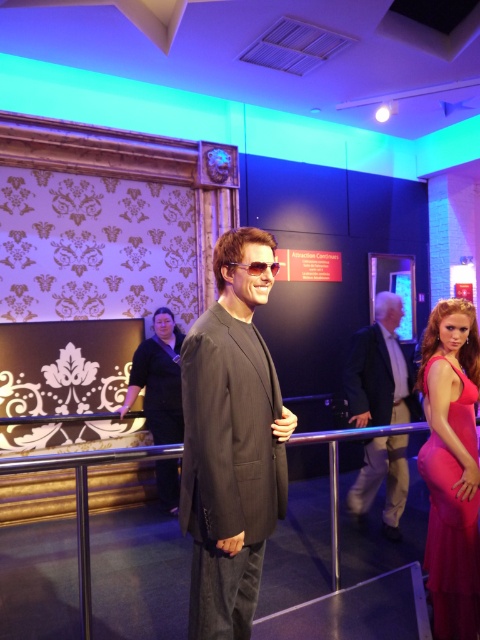
Question: Is dark gray suit at center wider than metallic silver rail at center?

Choices:
 (A) yes
 (B) no

Answer: (B)

Question: Does matte black suit at center lie in front of matte pink dress at right?

Choices:
 (A) no
 (B) yes

Answer: (B)

Question: Estimate the real-world distances between objects in this image. Which object is farther from the black fabric dress at center?

Choices:
 (A) matte pink dress at right
 (B) dark gray suit at center
 (C) sunglasses at center
 (D) matte black suit at center

Answer: (C)

Question: Does matte black suit at center lie behind dark gray suit at center?

Choices:
 (A) no
 (B) yes

Answer: (A)

Question: Which object is positioned closest to the matte pink dress at right?

Choices:
 (A) dark gray suit at center
 (B) sunglasses at center
 (C) black fabric dress at center

Answer: (A)

Question: Which point is closer to the camera?

Choices:
 (A) coord(84,572)
 (B) coord(433,596)
 (C) coord(278,262)
 (D) coord(380,419)

Answer: (A)